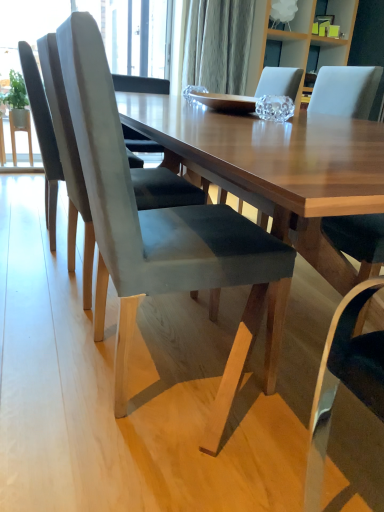
You are a GUI agent. You are given a task and a screenshot of the screen. Output one action in this format:
    pyautogui.click(x=<x>, y=<y>)
    Task: Click on the vacant space underneath suede gray chair at center, acting as the third chair starting from the back (from a real-world perspective)
    
    Given the screenshot: What is the action you would take?
    pyautogui.click(x=155, y=377)